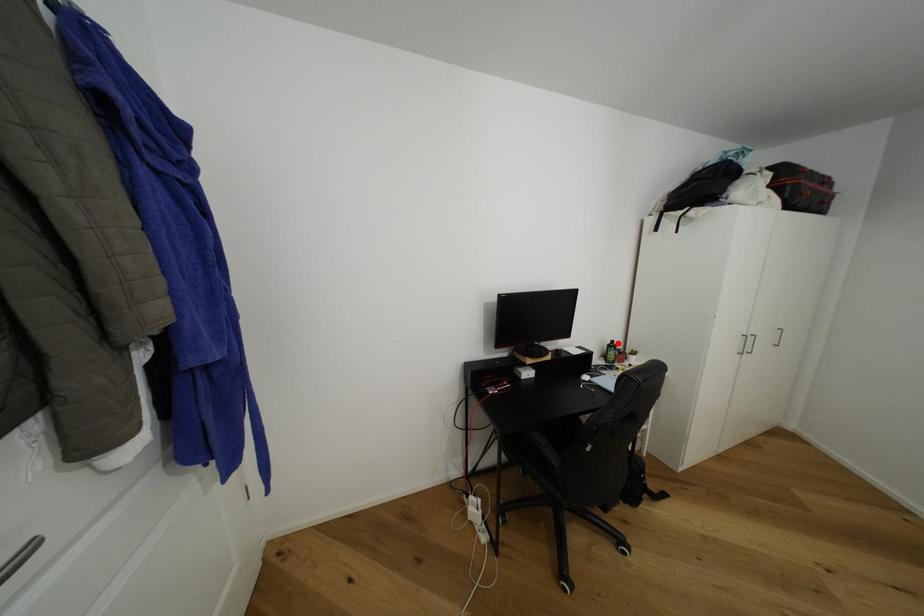
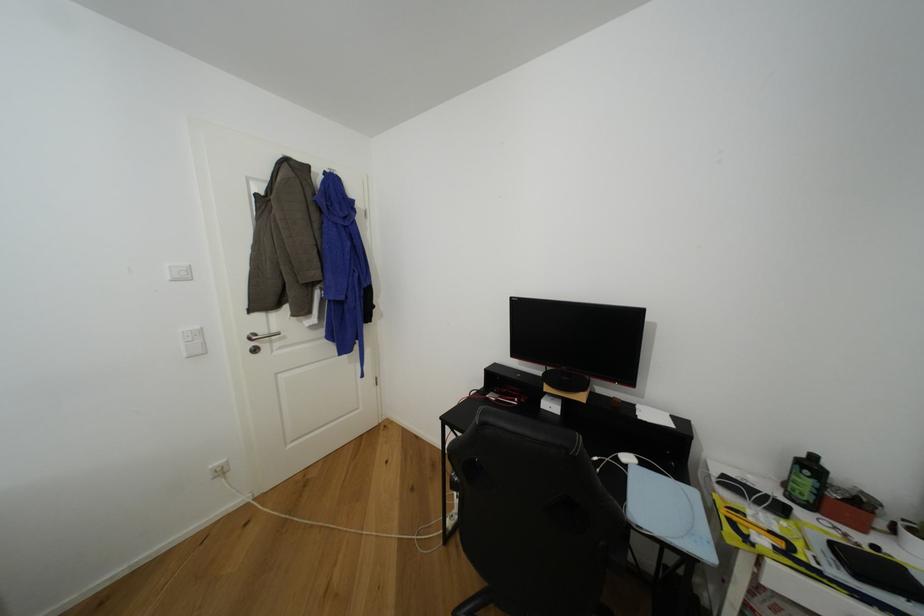
Where in the second image is the point corresponding to the highlighted location from the first image?

(820, 459)